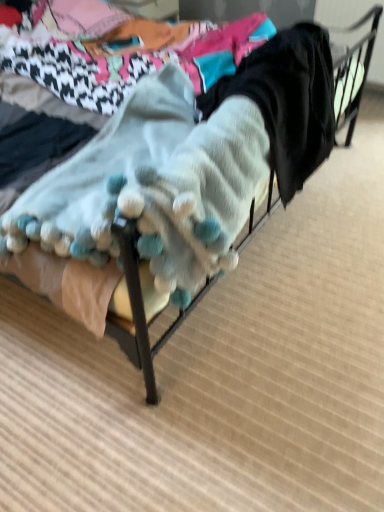
What are the coordinates of `knitted wool socks at center` in the screenshot? It's located at (287, 100).

What do you see at coordinates (287, 100) in the screenshot? I see `knitted wool socks at center` at bounding box center [287, 100].

Where is `fuzzy white blanket at center`? This screenshot has height=512, width=384. fuzzy white blanket at center is located at coordinates (152, 184).

The image size is (384, 512). Describe the element at coordinates (152, 184) in the screenshot. I see `fuzzy white blanket at center` at that location.

Locate an element on the screen. This screenshot has height=512, width=384. knitted wool socks at center is located at coordinates (287, 100).

Is knitted wool socks at center to the right of fuzzy white blanket at center from the viewer's perspective?

Indeed, knitted wool socks at center is positioned on the right side of fuzzy white blanket at center.

Does knitted wool socks at center lie behind fuzzy white blanket at center?

Yes, knitted wool socks at center is further from the camera.

Between point (274, 93) and point (164, 121), which one is positioned in front?

The point (274, 93) is more forward.

From the image's perspective, which object appears higher, knitted wool socks at center or fuzzy white blanket at center?

knitted wool socks at center is shown above in the image.

From a real-world perspective, who is located lower, knitted wool socks at center or fuzzy white blanket at center?

fuzzy white blanket at center is physically lower.

Between knitted wool socks at center and fuzzy white blanket at center, which one has smaller width?

knitted wool socks at center is thinner.

Considering the sizes of objects knitted wool socks at center and fuzzy white blanket at center in the image provided, who is shorter, knitted wool socks at center or fuzzy white blanket at center?

fuzzy white blanket at center is shorter.

Does knitted wool socks at center have a larger size compared to fuzzy white blanket at center?

Actually, knitted wool socks at center might be smaller than fuzzy white blanket at center.

In the scene shown: Is knitted wool socks at center outside of fuzzy white blanket at center?

Actually, knitted wool socks at center is at least partially inside fuzzy white blanket at center.

Are knitted wool socks at center and fuzzy white blanket at center far apart?

knitted wool socks at center is near fuzzy white blanket at center, not far away.

Does knitted wool socks at center turn towards fuzzy white blanket at center?

Yes, knitted wool socks at center is turned towards fuzzy white blanket at center.

At what (x,y) coordinates should I click in order to perform the action: click on clothing above the fuzzy white blanket at center (from the image's perspective). Please return your answer as a coordinate pair (x, y). This screenshot has width=384, height=512. Looking at the image, I should click on (287, 100).

Is fuzzy white blanket at center at the right side of knitted wool socks at center?

Incorrect, fuzzy white blanket at center is not on the right side of knitted wool socks at center.

Which object is further away from the camera, fuzzy white blanket at center or knitted wool socks at center?

knitted wool socks at center is behind.

Is point (211, 202) positioned after point (312, 102)?

That is False.

From the image's perspective, is fuzzy white blanket at center on knitted wool socks at center?

No, from the image's perspective, fuzzy white blanket at center is not on top of knitted wool socks at center.

From a real-world perspective, does fuzzy white blanket at center sit lower than knitted wool socks at center?

Indeed, from a real-world perspective, fuzzy white blanket at center is positioned beneath knitted wool socks at center.

Between fuzzy white blanket at center and knitted wool socks at center, which one has larger width?

With larger width is fuzzy white blanket at center.

Does fuzzy white blanket at center have a lesser height compared to knitted wool socks at center?

Indeed, fuzzy white blanket at center has a lesser height compared to knitted wool socks at center.

Who is smaller, fuzzy white blanket at center or knitted wool socks at center?

With smaller size is knitted wool socks at center.

Is knitted wool socks at center completely or partially inside fuzzy white blanket at center?

Yes, knitted wool socks at center is surrounded by fuzzy white blanket at center.

Is fuzzy white blanket at center directly adjacent to knitted wool socks at center?

There is a gap between fuzzy white blanket at center and knitted wool socks at center.

Is fuzzy white blanket at center facing away from knitted wool socks at center?

No, fuzzy white blanket at center is not facing the opposite direction of knitted wool socks at center.

How much distance is there between fuzzy white blanket at center and knitted wool socks at center?

They are 10.81 inches apart.

Locate an element on the screen. clothing that appears above the fuzzy white blanket at center (from the image's perspective) is located at coordinates (287, 100).

At what (x,y) coordinates should I click in order to perform the action: click on baby clothe below the knitted wool socks at center (from the image's perspective). Please return your answer as a coordinate pair (x, y). Looking at the image, I should click on (152, 184).

This screenshot has width=384, height=512. In order to click on baby clothe in front of the knitted wool socks at center in this screenshot , I will do `click(152, 184)`.